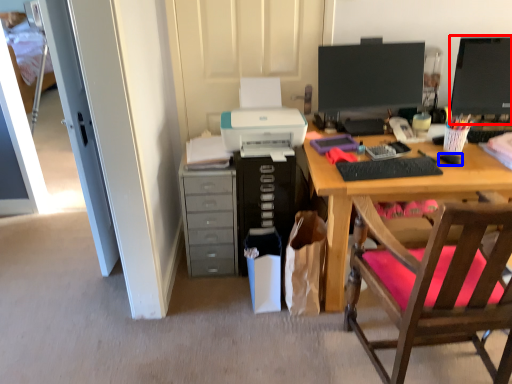
Question: Which of the following is the closest to the observer, computer monitor (highlighted by a red box) or mouse (highlighted by a blue box)?

Choices:
 (A) computer monitor
 (B) mouse

Answer: (B)